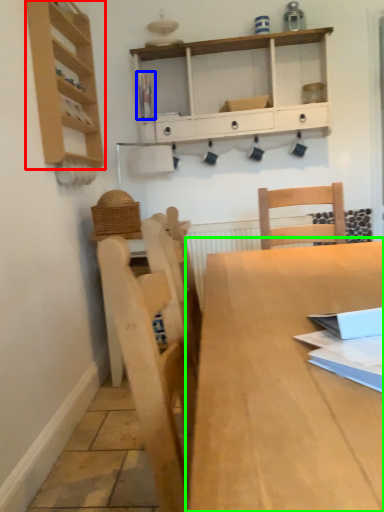
Question: Estimate the real-world distances between objects in this image. Which object is farther from shelf (highlighted by a red box), book (highlighted by a blue box) or table (highlighted by a green box)?

Choices:
 (A) book
 (B) table

Answer: (B)